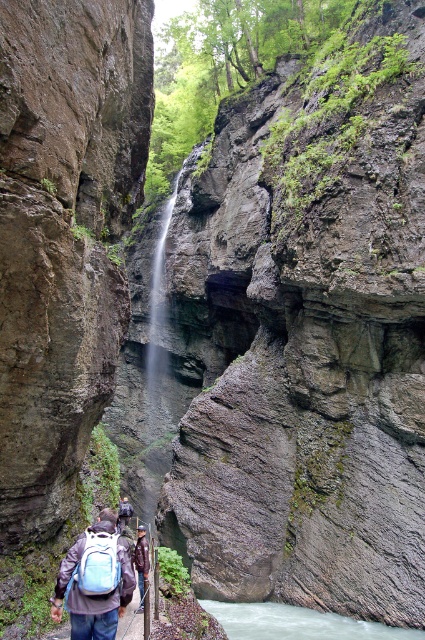
Can you confirm if white smooth river at center is positioned below light blue fabric backpack at lower center?

Correct, white smooth river at center is located below light blue fabric backpack at lower center.

Can you confirm if white smooth river at center is bigger than light blue fabric backpack at lower center?

Indeed, white smooth river at center has a larger size compared to light blue fabric backpack at lower center.

Does point (204, 600) lie in front of point (104, 576)?

No, it is not.

You are a GUI agent. You are given a task and a screenshot of the screen. Output one action in this format:
    pyautogui.click(x=<x>, y=<y>)
    Task: Click on the white smooth river at center
    The image size is (425, 640).
    Given the screenshot: What is the action you would take?
    pyautogui.click(x=297, y=624)

Is white smooth river at center to the left of dark blue backpack at center from the viewer's perspective?

In fact, white smooth river at center is to the right of dark blue backpack at center.

I want to click on white smooth river at center, so 297,624.

The width and height of the screenshot is (425, 640). I want to click on white smooth river at center, so click(x=297, y=624).

Between light blue fabric backpack at lower center and dark blue backpack at center, which one has less height?

Standing shorter between the two is light blue fabric backpack at lower center.

Is light blue fabric backpack at lower center taller than dark blue backpack at center?

Incorrect, light blue fabric backpack at lower center's height is not larger of dark blue backpack at center's.

Does point (93, 564) lie in front of point (147, 557)?

That is True.

Locate an element on the screen. The image size is (425, 640). light blue fabric backpack at lower center is located at coordinates (98, 564).